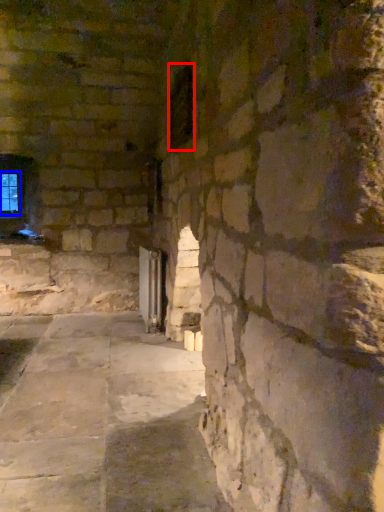
Question: Which of the following is the farthest to the observer, window (highlighted by a red box) or window (highlighted by a blue box)?

Choices:
 (A) window
 (B) window

Answer: (B)